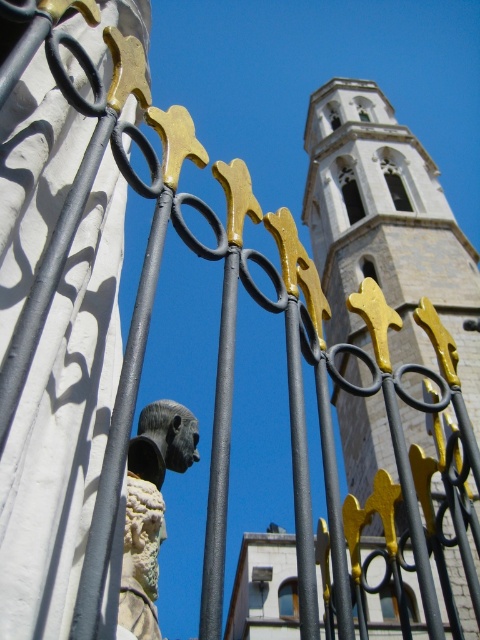
You are an architect examining the image of a fence with a stone tower and a white stone bust. Based on the spatial relationship between the stone tower at upper center and the white stone bust at center, which object appears larger in the image?

The stone tower at upper center might be wider than the white stone bust at center, so it likely appears larger in the image.

You are standing in front of the ornate metal fence and want to take a photo of both the stone tower at upper center and the white stone bust at center. To ensure both are in frame, should you adjust your camera to the left or right?

The stone tower at upper center is to the right of the white stone bust at center, so you should adjust your camera to the left to include both in the frame.

You are standing in front of an ornate metal fence with golden accents. You notice a point marked at coordinates (385, 227). What significant structure is located at that point?

The stone tower at upper center is located at point (385, 227).